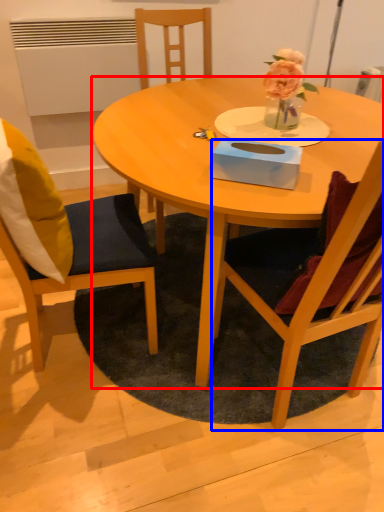
Question: Which object is closer to the camera taking this photo, coffee table (highlighted by a red box) or chair (highlighted by a blue box)?

Choices:
 (A) coffee table
 (B) chair

Answer: (B)